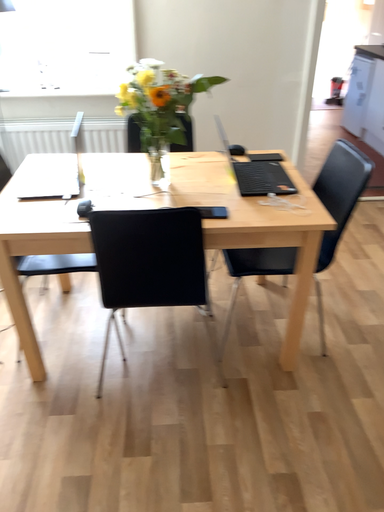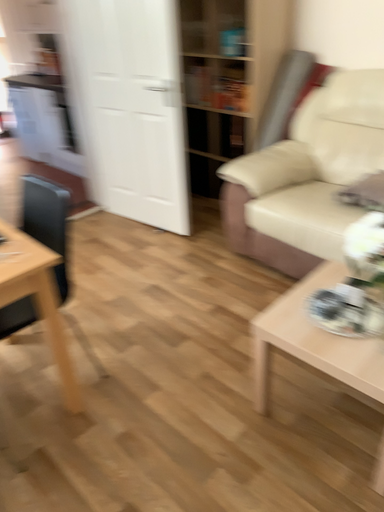
Question: Which way did the camera rotate in the video?

Choices:
 (A) rotated downward
 (B) rotated upward

Answer: (B)